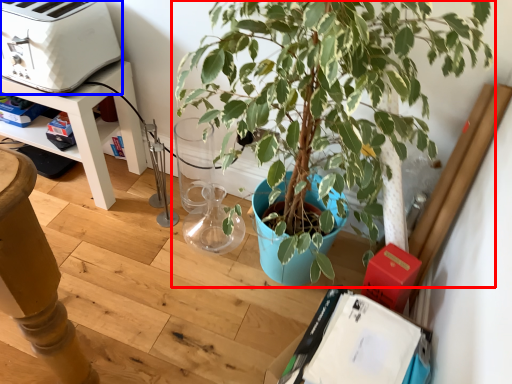
Question: Which object appears closest to the camera in this image, houseplant (highlighted by a red box) or appliance (highlighted by a blue box)?

Choices:
 (A) houseplant
 (B) appliance

Answer: (A)